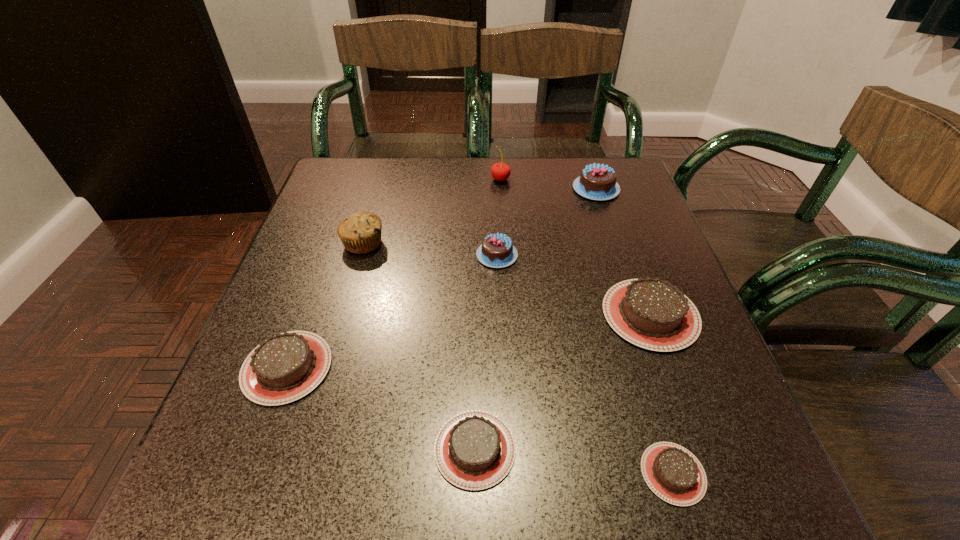
Locate an element on the screen. vacant area between the second tallest object and the biggest brown chocolate cake is located at coordinates (507, 279).

You are a GUI agent. You are given a task and a screenshot of the screen. Output one action in this format:
    pyautogui.click(x=<x>, y=<y>)
    Task: Click on the free space that is in between the sixth tallest object and the red cherry
    The image size is (960, 540).
    Given the screenshot: What is the action you would take?
    pyautogui.click(x=394, y=273)

In order to click on empty space that is in between the leftmost brown chocolate cake and the biggest brown chocolate cake in this screenshot , I will do `click(468, 341)`.

Locate an element on the screen. This screenshot has height=540, width=960. object that can be found as the third closest to the nearer pink chocolate cake is located at coordinates (597, 182).

Find the location of `object that is the fourth closest to the tallest object`. object that is the fourth closest to the tallest object is located at coordinates pos(653,314).

In order to click on chocolate cake that is the fifth closest to the red cherry in this screenshot , I will do `click(474, 450)`.

Where is `chocolate cake that is the second nearest to the sixth shortest object`? The height and width of the screenshot is (540, 960). chocolate cake that is the second nearest to the sixth shortest object is located at coordinates (653, 314).

Where is `the closest brown chocolate cake to the cherry`? The width and height of the screenshot is (960, 540). the closest brown chocolate cake to the cherry is located at coordinates (653, 314).

Locate an element on the screen. The width and height of the screenshot is (960, 540). the closest brown chocolate cake relative to the nearer pink chocolate cake is located at coordinates (653, 314).

Locate an element on the screen. The image size is (960, 540). free spot that satisfies the following two spatial constraints: 1. on the front side of the biggest brown chocolate cake; 2. on the right side of the sixth shortest object is located at coordinates (637, 314).